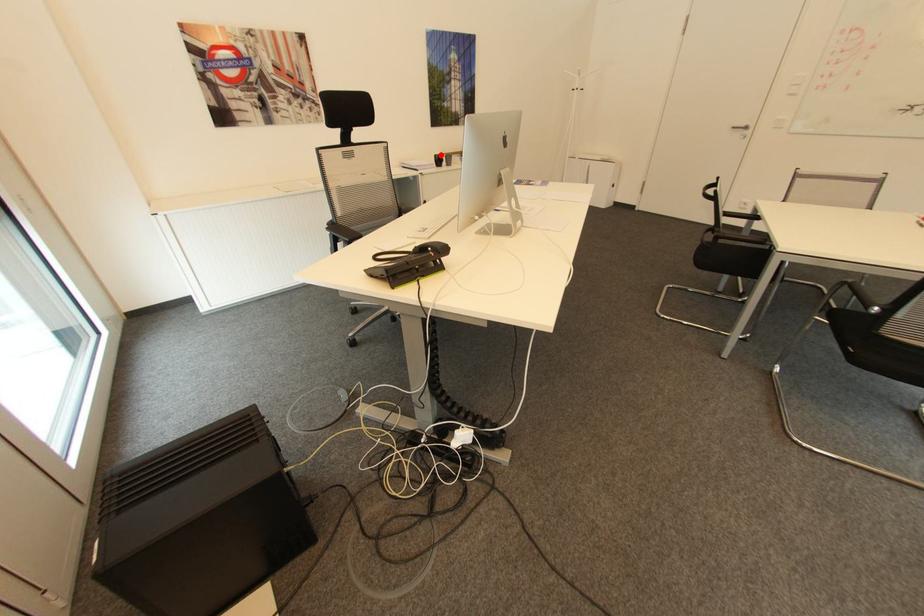
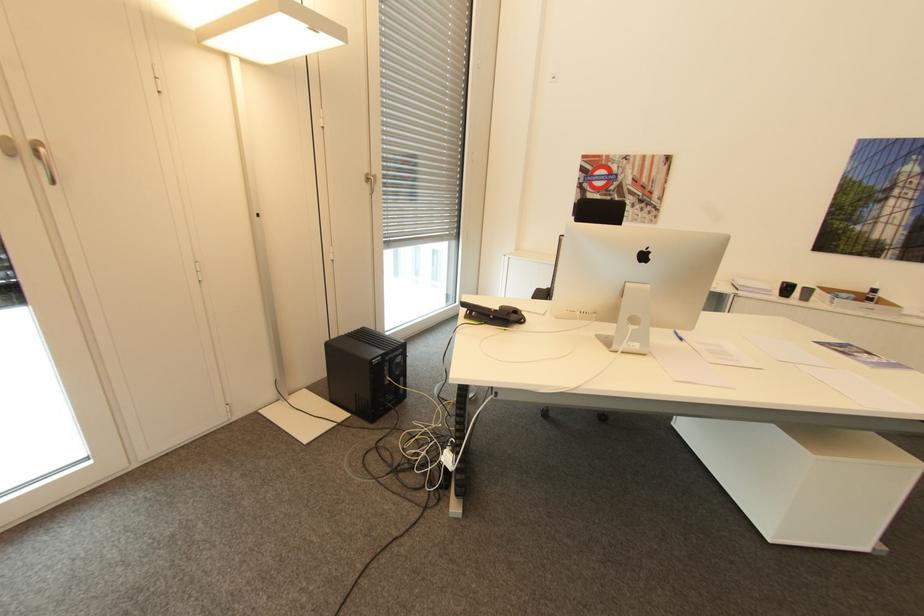
Locate, in the second image, the point that corresponds to the highlighted location in the first image.

(788, 283)